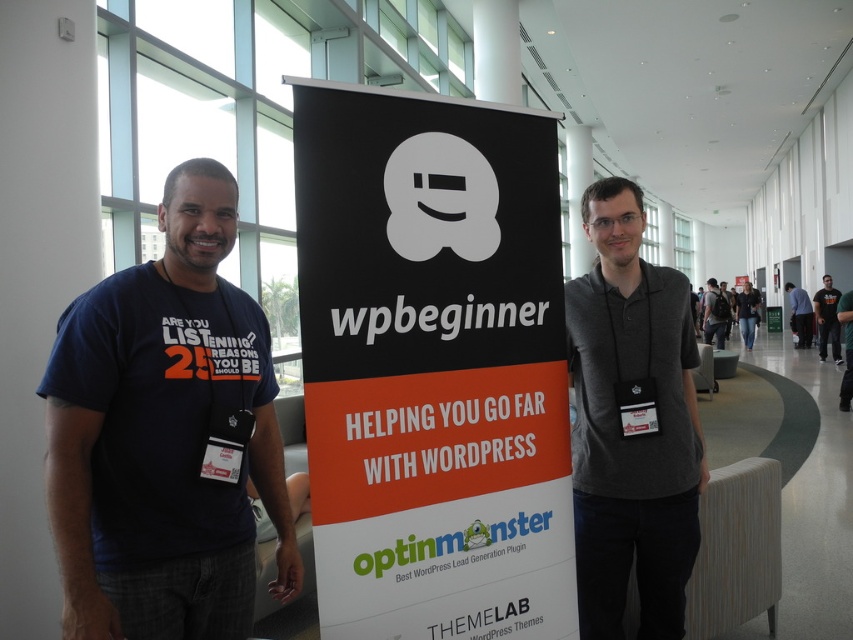
Question: In this image, where is dark blue t-shirt at left located relative to gray cotton polo shirt at center?

Choices:
 (A) left
 (B) right

Answer: (A)

Question: Is black t-shirt at right bigger than jeans at center?

Choices:
 (A) no
 (B) yes

Answer: (A)

Question: Among these points, which one is farthest from the camera?

Choices:
 (A) click(x=723, y=304)
 (B) click(x=799, y=296)
 (C) click(x=755, y=316)

Answer: (C)

Question: Which point appears farthest from the camera in this image?

Choices:
 (A) (827, 320)
 (B) (468, 534)

Answer: (A)

Question: Which point is farther from the camera taking this photo?

Choices:
 (A) (743, 326)
 (B) (711, 307)
 (C) (827, 289)
 (D) (799, 323)

Answer: (A)

Question: Can you confirm if gray cotton polo shirt at center is positioned below jeans at center?

Choices:
 (A) no
 (B) yes

Answer: (B)